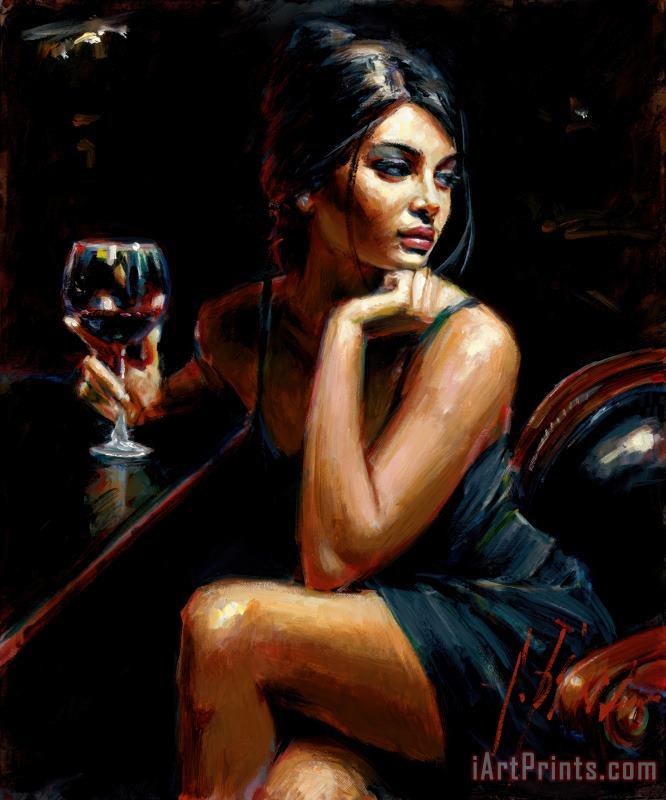
You are a GUI agent. You are given a task and a screenshot of the screen. Output one action in this format:
    pyautogui.click(x=<x>, y=<y>)
    Task: Click on the chair
    The image size is (666, 800).
    Given the screenshot: What is the action you would take?
    pyautogui.click(x=597, y=697)